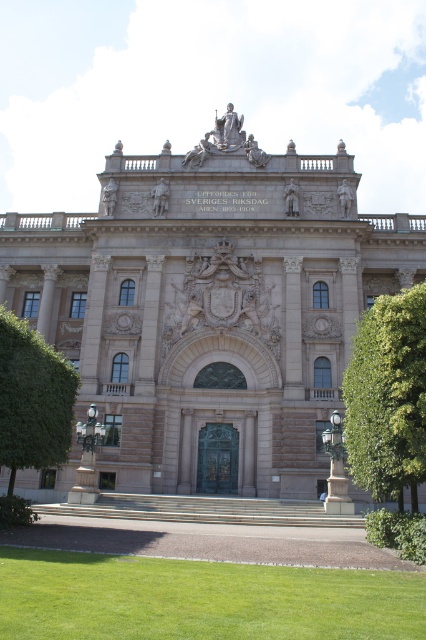
Consider the image. Who is shorter, beige stone palace at center or green leafy tree at right?

green leafy tree at right

Measure the distance between point (155, 225) and camera.

The distance of point (155, 225) from camera is 246.13 feet.

Find the location of `beige stone palace at center`. beige stone palace at center is located at coordinates (210, 308).

Can you confirm if green leafy tree at right is positioned below polished bronze lamp post at lower right?

No.

Between green leafy tree at right and polished bronze lamp post at lower right, which one appears on the left side from the viewer's perspective?

polished bronze lamp post at lower right is more to the left.

Does point (416, 429) come closer to viewer compared to point (339, 497)?

Yes, point (416, 429) is in front of point (339, 497).

Where is `green leafy tree at right`? green leafy tree at right is located at coordinates (388, 396).

Is point (3, 337) closer to viewer compared to point (330, 493)?

Yes, point (3, 337) is in front of point (330, 493).

Can you confirm if green leafy tree at left is shorter than polished bronze lamp post at lower right?

In fact, green leafy tree at left may be taller than polished bronze lamp post at lower right.

Who is more forward, (39, 372) or (328, 449)?

Positioned in front is point (39, 372).

In order to click on green leafy tree at left in this screenshot , I will do `click(32, 397)`.